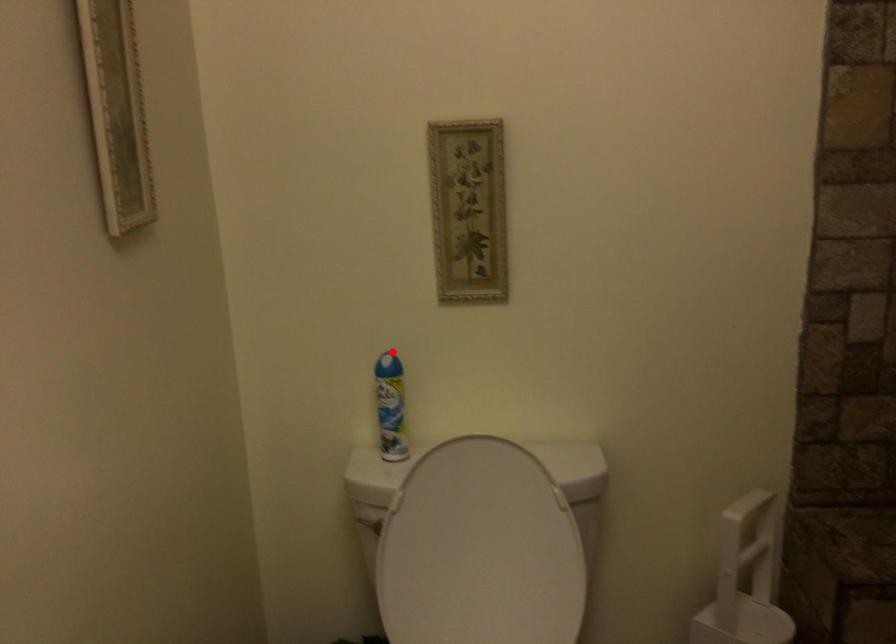
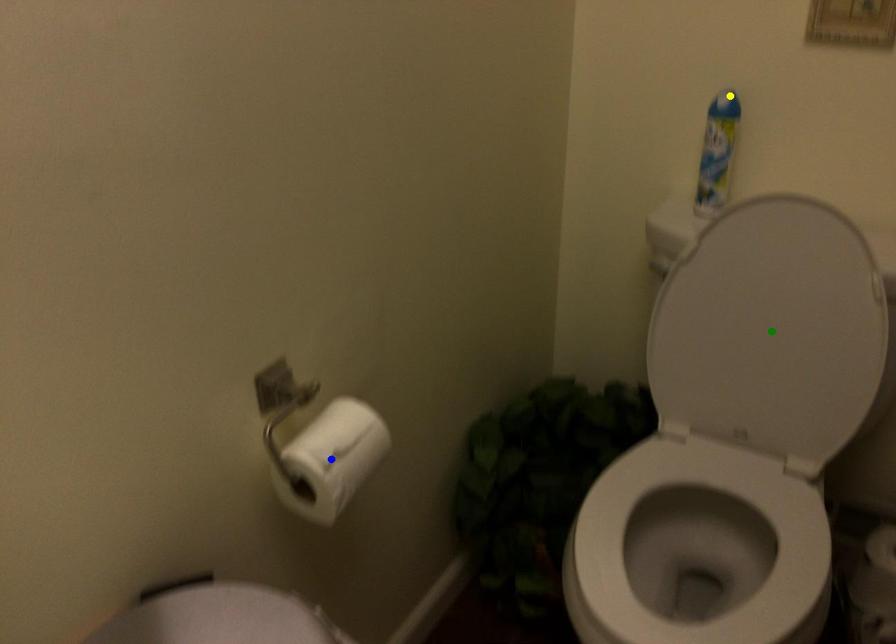
Question: I am providing you with two images of the same scene from different viewpoints. A red point is marked on the first image. You are given multiple points on the second image. Which point in image 2 is actually the same real-world point as the red point in image 1?

Choices:
 (A) green point
 (B) yellow point
 (C) blue point

Answer: (B)